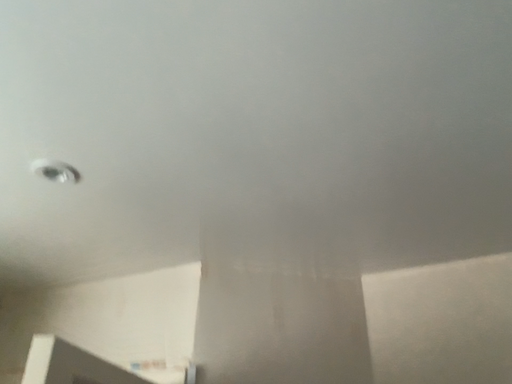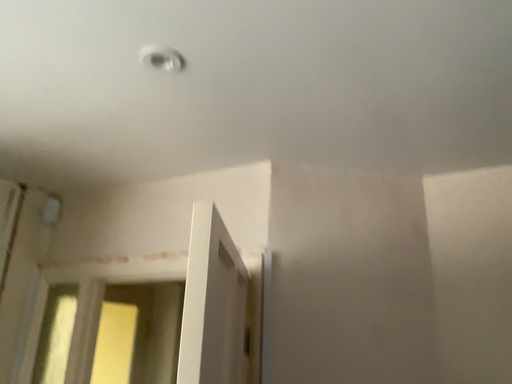
Question: How did the camera likely rotate when shooting the video?

Choices:
 (A) rotated upward
 (B) rotated downward

Answer: (B)